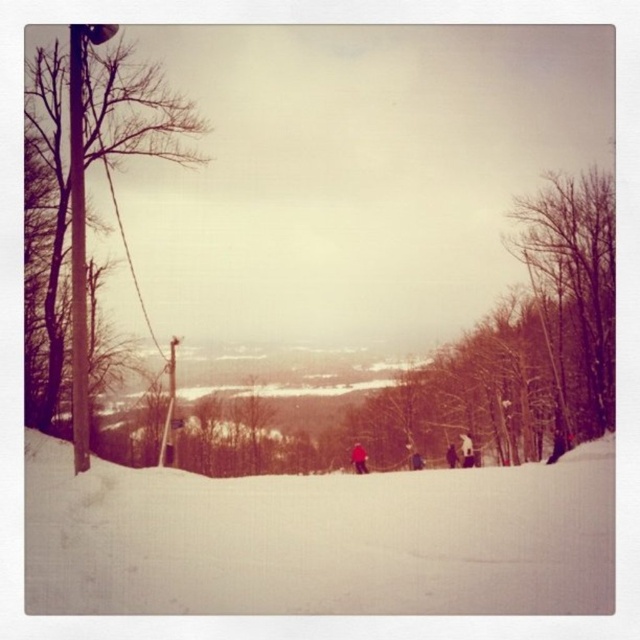
Question: Which is nearer to the red fabric jacket at center?

Choices:
 (A) white snow at center
 (B) bare wood pole at left
 (C) bare branches at right

Answer: (C)

Question: Which point is farther to the camera?

Choices:
 (A) bare branches at right
 (B) white snow at center
 (C) bare wood pole at left

Answer: (A)

Question: Does bare wood pole at left appear on the left side of bare branches at right?

Choices:
 (A) yes
 (B) no

Answer: (A)

Question: Which of the following is the closest to the observer?

Choices:
 (A) red fabric jacket at center
 (B) bare branches at right

Answer: (A)

Question: Can you confirm if bare branches at right is smaller than red fabric jacket at center?

Choices:
 (A) no
 (B) yes

Answer: (A)

Question: Where is bare wood pole at left located in relation to bare branches at right in the image?

Choices:
 (A) left
 (B) right

Answer: (A)